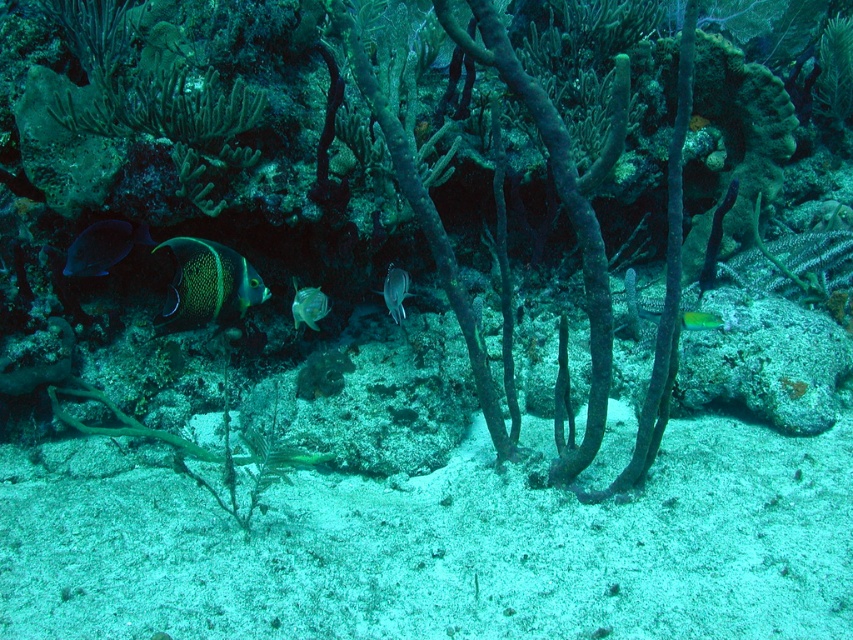
Between shiny blue fish at center and matte blue fish at left, which one appears on the right side from the viewer's perspective?

Positioned to the right is shiny blue fish at center.

Is point (192, 262) positioned in front of point (137, 227)?

Yes, it is in front of point (137, 227).

Who is more distant from viewer, (196,308) or (105,257)?

Positioned behind is point (105,257).

Where is `shiny blue fish at center`? shiny blue fish at center is located at coordinates (206, 285).

In the scene shown: Is matte blue fish at left further to camera compared to translucent glass fish at center?

No.

The image size is (853, 640). I want to click on matte blue fish at left, so click(103, 246).

This screenshot has height=640, width=853. I want to click on matte blue fish at left, so click(x=103, y=246).

Consider the image. Is translucent green fish at center to the right of green iridescent fish at center from the viewer's perspective?

No, translucent green fish at center is not to the right of green iridescent fish at center.

Which is in front, point (309, 294) or point (708, 326)?

Point (309, 294)

What do you see at coordinates (308, 305) in the screenshot? The height and width of the screenshot is (640, 853). I see `translucent green fish at center` at bounding box center [308, 305].

In order to click on translucent green fish at center in this screenshot , I will do `click(308, 305)`.